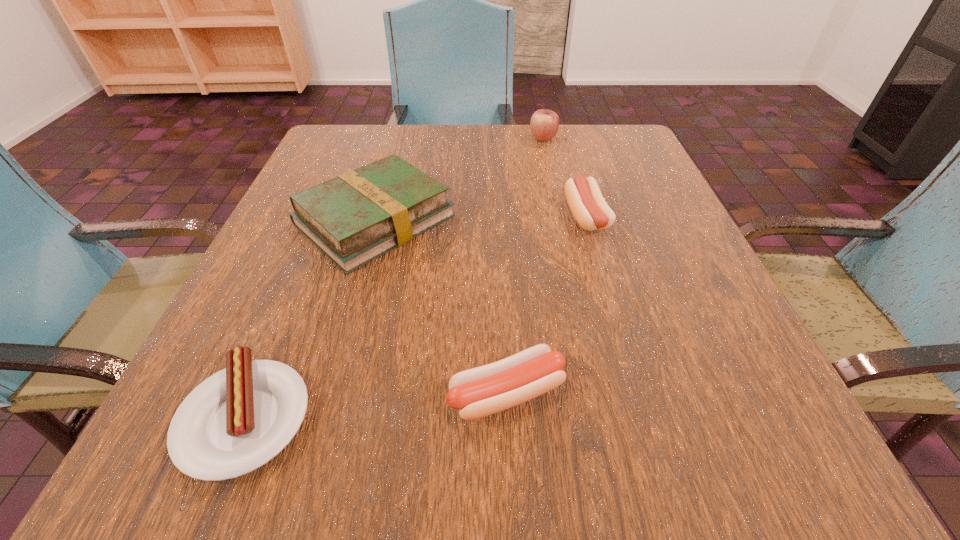
The width and height of the screenshot is (960, 540). I want to click on the farthest object, so click(544, 124).

At what (x,y) coordinates should I click in order to perform the action: click on the tallest object. Please return your answer as a coordinate pair (x, y). Looking at the image, I should click on (544, 124).

This screenshot has height=540, width=960. What are the coordinates of `book` in the screenshot? It's located at pyautogui.click(x=358, y=216).

The width and height of the screenshot is (960, 540). Find the location of `the farthest sausage`. the farthest sausage is located at coordinates (589, 208).

Image resolution: width=960 pixels, height=540 pixels. What are the coordinates of `the third object from left to right` in the screenshot? It's located at (478, 392).

Where is `the shortest object`? the shortest object is located at coordinates (237, 420).

You are a GUI agent. You are given a task and a screenshot of the screen. Output one action in this format:
    pyautogui.click(x=<x>, y=<y>)
    Task: Click on the shortest sausage
    The image size is (960, 540).
    Given the screenshot: What is the action you would take?
    pyautogui.click(x=237, y=420)

You are a GUI agent. You are given a task and a screenshot of the screen. Output one action in this format:
    pyautogui.click(x=<x>, y=<y>)
    Task: Click on the free space located 0.150m on the front of the farthest object
    The image size is (960, 540).
    Given the screenshot: What is the action you would take?
    pyautogui.click(x=552, y=180)

The width and height of the screenshot is (960, 540). Find the location of `vacant space positioned on the front of the book`. vacant space positioned on the front of the book is located at coordinates (342, 339).

Locate an element on the screen. The image size is (960, 540). vacant region located 0.120m on the back of the rightmost sausage is located at coordinates (571, 164).